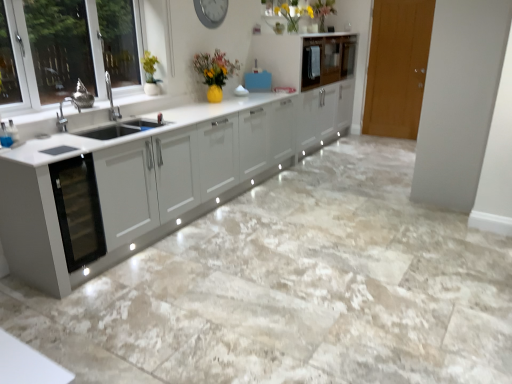
The width and height of the screenshot is (512, 384). Describe the element at coordinates (303, 12) in the screenshot. I see `matte yellow vase at upper center` at that location.

Measure the distance between glossy white cabinet at upper center, which is the 1th cabinetry from back to front, and camera.

glossy white cabinet at upper center, which is the 1th cabinetry from back to front, is 15.81 feet away from camera.

Find the location of `glossy wood cabinet at upper center, the 1th cabinetry when ordered from front to back`. glossy wood cabinet at upper center, the 1th cabinetry when ordered from front to back is located at coordinates (306, 58).

Find the location of `matte yellow vase at upper center`. matte yellow vase at upper center is located at coordinates (303, 12).

Is the position of metallic gray clock at upper center less distant than that of wooden door at right?

Yes, it is.

Is point (195, 5) behind point (402, 72)?

No, it is in front of (402, 72).

Considering the sizes of objects metallic gray clock at upper center and wooden door at right in the image provided, who is thinner, metallic gray clock at upper center or wooden door at right?

metallic gray clock at upper center is thinner.

From a real-world perspective, is glossy white cabinet at upper center, which is the 1th cabinetry from back to front, physically located above or below wooden door at right?

glossy white cabinet at upper center, which is the 1th cabinetry from back to front, is situated higher than wooden door at right in the real world.

Which of these two, glossy white cabinet at upper center, which is the second cabinetry in front-to-back order, or wooden door at right, is bigger?

glossy white cabinet at upper center, which is the second cabinetry in front-to-back order.

Where is `door below the glossy white cabinet at upper center, which is the 1th cabinetry from back to front (from a real-world perspective)`? door below the glossy white cabinet at upper center, which is the 1th cabinetry from back to front (from a real-world perspective) is located at coordinates (397, 67).

In the scene shown: Measure the distance from glossy white cabinet at upper center, which is the 1th cabinetry from back to front, to wooden door at right.

A distance of 33.43 inches exists between glossy white cabinet at upper center, which is the 1th cabinetry from back to front, and wooden door at right.

Which object is more forward, glossy wood cabinet at upper center, the second cabinetry when ordered from back to front, or glossy white cabinet at upper center, which is the second cabinetry in front-to-back order?

glossy wood cabinet at upper center, the second cabinetry when ordered from back to front.

From the image's perspective, which is above, glossy wood cabinet at upper center, the second cabinetry when ordered from back to front, or glossy white cabinet at upper center, which is the 1th cabinetry from back to front?

glossy white cabinet at upper center, which is the 1th cabinetry from back to front, from the image's perspective.

Which is correct: glossy wood cabinet at upper center, the 1th cabinetry when ordered from front to back, is inside glossy white cabinet at upper center, which is the second cabinetry in front-to-back order, or outside of it?

glossy wood cabinet at upper center, the 1th cabinetry when ordered from front to back, is not inside glossy white cabinet at upper center, which is the second cabinetry in front-to-back order, it's outside.

Considering the points (312, 80) and (348, 44), which point is behind, point (312, 80) or point (348, 44)?

The point (348, 44) is farther.

Is matte yellow vase at upper center facing towards metallic gray clock at upper center?

No, matte yellow vase at upper center is not oriented towards metallic gray clock at upper center.

Is matte yellow vase at upper center beside metallic gray clock at upper center?

No, matte yellow vase at upper center is not touching metallic gray clock at upper center.

Where is `cabinetry above the metallic gray clock at upper center (from the image's perspective)`? Image resolution: width=512 pixels, height=384 pixels. cabinetry above the metallic gray clock at upper center (from the image's perspective) is located at coordinates (327, 60).

From a real-world perspective, is metallic gray clock at upper center above or below glossy white cabinet at upper center, which is the second cabinetry in front-to-back order?

In terms of real-world spatial position, metallic gray clock at upper center is above glossy white cabinet at upper center, which is the second cabinetry in front-to-back order.

Considering the positions of objects metallic gray clock at upper center and glossy white cabinet at upper center, which is the 1th cabinetry from back to front, in the image provided, who is more to the left, metallic gray clock at upper center or glossy white cabinet at upper center, which is the 1th cabinetry from back to front,?

Positioned to the left is metallic gray clock at upper center.

From the image's perspective, is glossy wood cabinet at upper center, the 1th cabinetry when ordered from front to back, located beneath metallic gray clock at upper center?

Yes, from the image's perspective, glossy wood cabinet at upper center, the 1th cabinetry when ordered from front to back, is beneath metallic gray clock at upper center.

In terms of width, does glossy wood cabinet at upper center, the second cabinetry when ordered from back to front, look wider or thinner when compared to metallic gray clock at upper center?

Clearly, glossy wood cabinet at upper center, the second cabinetry when ordered from back to front, has more width compared to metallic gray clock at upper center.

Is glossy wood cabinet at upper center, the second cabinetry when ordered from back to front, positioned far away from metallic gray clock at upper center?

Absolutely, glossy wood cabinet at upper center, the second cabinetry when ordered from back to front, is distant from metallic gray clock at upper center.

What's the angular difference between glossy wood cabinet at upper center, the 1th cabinetry when ordered from front to back, and metallic gray clock at upper center's facing directions?

0.0767 degrees.

Can you confirm if glossy wood cabinet at upper center, the 1th cabinetry when ordered from front to back, is smaller than matte yellow vase at upper center?

Incorrect, glossy wood cabinet at upper center, the 1th cabinetry when ordered from front to back, is not smaller in size than matte yellow vase at upper center.

Considering the sizes of objects glossy wood cabinet at upper center, the 1th cabinetry when ordered from front to back, and matte yellow vase at upper center in the image provided, who is taller, glossy wood cabinet at upper center, the 1th cabinetry when ordered from front to back, or matte yellow vase at upper center?

glossy wood cabinet at upper center, the 1th cabinetry when ordered from front to back, is taller.

Find the location of a particular element. The image size is (512, 384). floral arrangement on the left of glossy wood cabinet at upper center, the 1th cabinetry when ordered from front to back is located at coordinates (303, 12).

From a real-world perspective, is glossy wood cabinet at upper center, the second cabinetry when ordered from back to front, located higher than matte yellow vase at upper center?

Actually, glossy wood cabinet at upper center, the second cabinetry when ordered from back to front, is physically below matte yellow vase at upper center in the real world.

This screenshot has width=512, height=384. Identify the location of door on the right of metallic gray clock at upper center. (397, 67).

Locate an element on the screen. The image size is (512, 384). door lying below the glossy white cabinet at upper center, which is the second cabinetry in front-to-back order (from the image's perspective) is located at coordinates (397, 67).

Which object lies nearer to the anchor point metallic gray clock at upper center, wooden door at right or glossy white cabinet at upper center, which is the 1th cabinetry from back to front?

glossy white cabinet at upper center, which is the 1th cabinetry from back to front, lies closer to metallic gray clock at upper center than the other object.

Considering their positions, is glossy white cabinet at upper center, which is the 1th cabinetry from back to front, positioned further to wooden door at right than matte yellow vase at upper center?

matte yellow vase at upper center is further to wooden door at right.

Based on their spatial positions, is matte yellow vase at upper center or glossy white cabinet at upper center, which is the 1th cabinetry from back to front, closer to glossy wood cabinet at upper center, the second cabinetry when ordered from back to front?

Among the two, glossy white cabinet at upper center, which is the 1th cabinetry from back to front, is located nearer to glossy wood cabinet at upper center, the second cabinetry when ordered from back to front.

From the image, which object appears to be nearer to glossy wood cabinet at upper center, the second cabinetry when ordered from back to front, metallic gray clock at upper center or matte yellow vase at upper center?

matte yellow vase at upper center is closer to glossy wood cabinet at upper center, the second cabinetry when ordered from back to front.

Which object lies further to the anchor point matte yellow vase at upper center, wooden door at right or glossy white cabinet at upper center, which is the 1th cabinetry from back to front?

wooden door at right.

Looking at the image, which one is located closer to wooden door at right, metallic gray clock at upper center or matte yellow vase at upper center?

→ Among the two, matte yellow vase at upper center is located nearer to wooden door at right.

From the image, which object appears to be farther from matte yellow vase at upper center, glossy white cabinet at upper center, which is the second cabinetry in front-to-back order, or glossy wood cabinet at upper center, the second cabinetry when ordered from back to front?

Among the two, glossy white cabinet at upper center, which is the second cabinetry in front-to-back order, is located further to matte yellow vase at upper center.

From the image, which object appears to be nearer to metallic gray clock at upper center, matte yellow vase at upper center or glossy white cabinet at upper center, which is the second cabinetry in front-to-back order?

The object closer to metallic gray clock at upper center is matte yellow vase at upper center.

At what (x,y) coordinates should I click in order to perform the action: click on floral arrangement positioned between metallic gray clock at upper center and glossy white cabinet at upper center, which is the 1th cabinetry from back to front, from near to far. Please return your answer as a coordinate pair (x, y). The width and height of the screenshot is (512, 384). Looking at the image, I should click on (303, 12).

The width and height of the screenshot is (512, 384). In order to click on cabinetry located between metallic gray clock at upper center and glossy white cabinet at upper center, which is the 1th cabinetry from back to front, in the depth direction in this screenshot , I will do `click(306, 58)`.

Locate an element on the screen. This screenshot has height=384, width=512. floral arrangement between metallic gray clock at upper center and wooden door at right from left to right is located at coordinates (303, 12).

This screenshot has width=512, height=384. I want to click on floral arrangement located between metallic gray clock at upper center and glossy wood cabinet at upper center, the second cabinetry when ordered from back to front, in the left-right direction, so tap(303, 12).